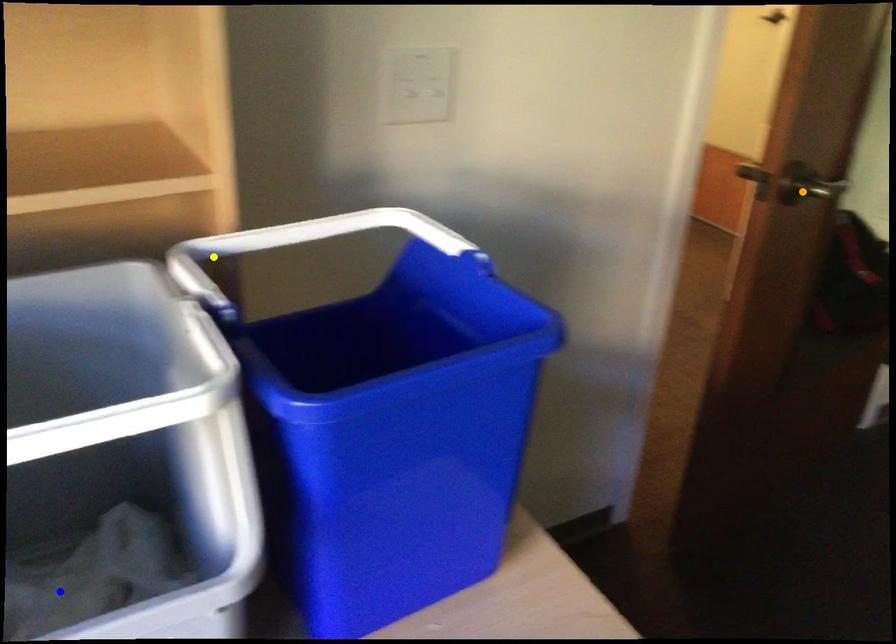
Order these from nearest to farthest:
A) blue point
B) yellow point
C) orange point

blue point, yellow point, orange point